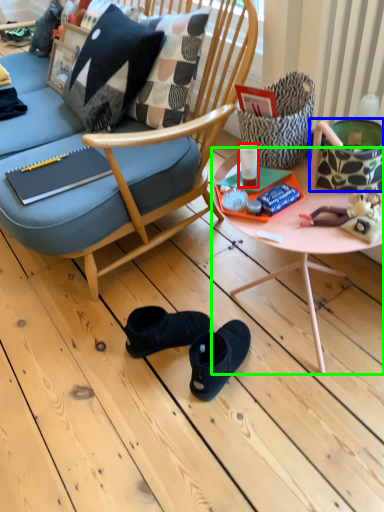
Question: Which object is positioned closest to coffee cup (highlighted by a red box)? Select from handbag (highlighted by a blue box) and desk (highlighted by a green box).

Choices:
 (A) handbag
 (B) desk

Answer: (B)